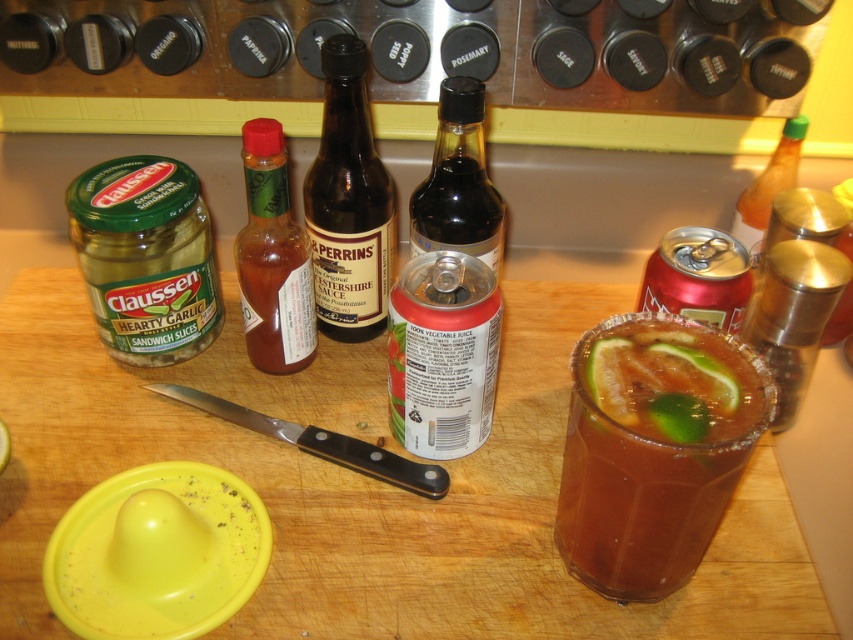
Question: Can you confirm if translucent glass hot sauce at center is positioned to the left of green glass bottle at right?

Choices:
 (A) no
 (B) yes

Answer: (B)

Question: From the image, what is the correct spatial relationship of translucent glass hot sauce at center in relation to black glass bottle at center?

Choices:
 (A) below
 (B) above

Answer: (A)

Question: Which of these objects is positioned farthest from the translucent glass margarita at center?

Choices:
 (A) wooden cutting board at center
 (B) translucent glass hot sauce at center

Answer: (B)

Question: Which of these objects is positioned closest to the black glass bottle at center?

Choices:
 (A) wooden cutting board at center
 (B) green glass bottle at right
 (C) translucent glass margarita at center
 (D) brown glass bottle at center

Answer: (D)

Question: Which point is closer to the camera?

Choices:
 (A) black glass bottle at center
 (B) translucent glass margarita at center

Answer: (B)

Question: Is translucent glass margarita at center above translucent glass hot sauce at center?

Choices:
 (A) yes
 (B) no

Answer: (B)